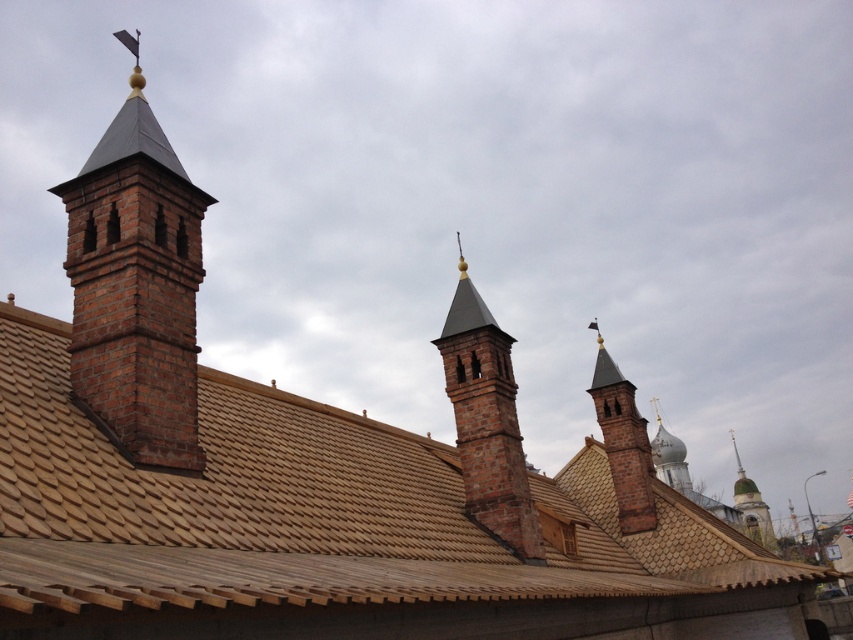
You are an architect analyzing the building structure. You need to determine which of the two structures, the brick chimney at left or the greenish stone tower at right, has a greater height. Based on the scene, which one is taller?

The greenish stone tower at right is taller than the brick chimney at left, so the greenish stone tower at right has a greater height.